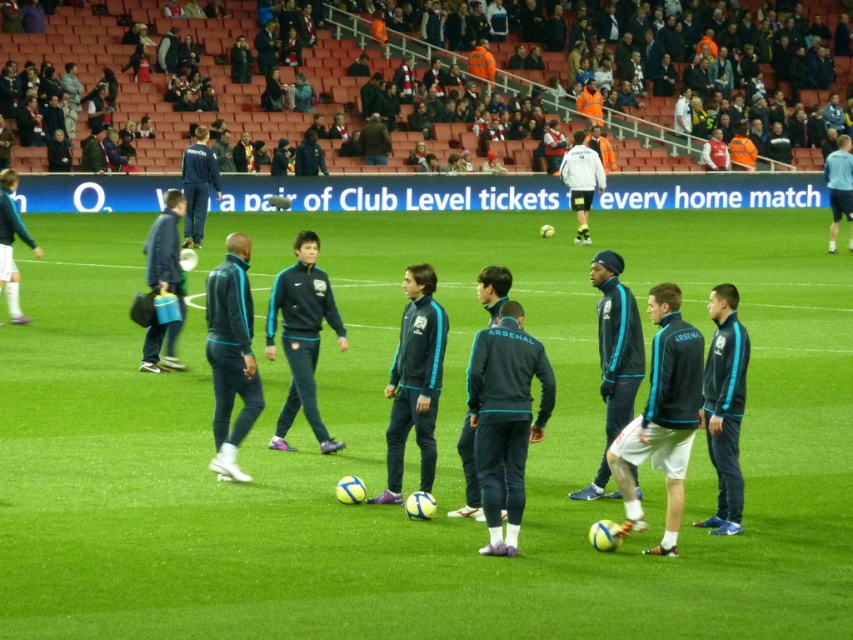
Looking at this image, you are a photographer at the soccer training session. You notice two jackets in the image, a blue fabric jacket at left and a light blue fabric jacket at upper right. Which jacket appears smaller in size?

The blue fabric jacket at left appears smaller in size compared to the light blue fabric jacket at upper right.

You are a photographer at the soccer training session. You want to capture a photo of both the teal fabric tracksuit at center and the teal synthetic jacket at center in the same frame. Given that your camera has a minimum focus distance of 30 inches, will you be able to adjust your position to include both in focus?

The teal fabric tracksuit at center and teal synthetic jacket at center are 29.96 inches apart, which is just below the camera minimum focus distance of 30 inches. Therefore, you will not be able to capture both in focus with your current camera settings.